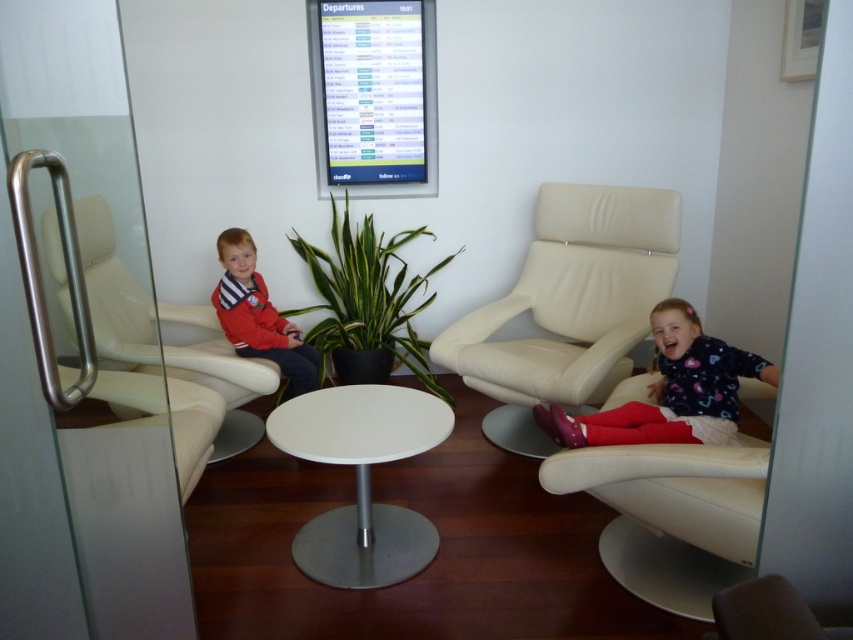
Which is more to the right, white glossy table at center or white leather armchair at left?

white glossy table at center

Can you confirm if white glossy table at center is bigger than white leather armchair at left?

Indeed, white glossy table at center has a larger size compared to white leather armchair at left.

Is point (317, 438) positioned before point (93, 198)?

No, it is behind (93, 198).

This screenshot has width=853, height=640. In order to click on white glossy table at center in this screenshot , I will do `click(361, 480)`.

Can you confirm if beige leather chair at right is shorter than white glossy table at center?

No.

Looking at this image, is the position of beige leather chair at right less distant than that of white glossy table at center?

No, beige leather chair at right is further to the viewer.

Identify the location of beige leather chair at right. (569, 307).

Can you confirm if white glossy table at center is shorter than matte red jacket at left?

Indeed, white glossy table at center has a lesser height compared to matte red jacket at left.

Is point (381, 422) closer to camera compared to point (231, 230)?

Yes, point (381, 422) is in front of point (231, 230).

What are the coordinates of `white glossy table at center` in the screenshot? It's located at (361, 480).